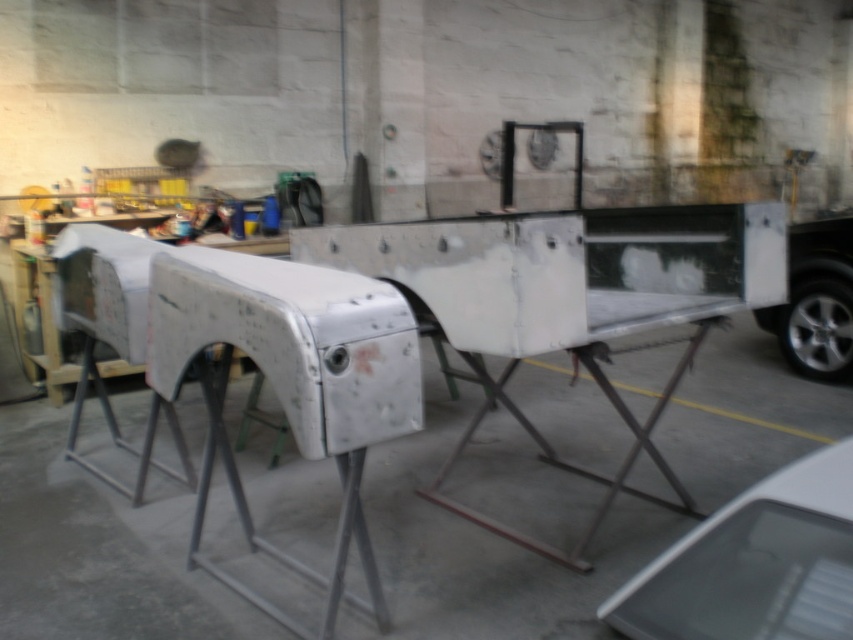
Looking at this image, you are a mechanic working in the workshop shown. You need to reach both the point at coordinates point [785,484] and point [834,308]. Which point should you approach first to reach them in the most efficient path?

You should approach point [785,484] first because it is in front of point [834,308], so reaching it first allows you to efficiently move backward to the second point without retracing steps.

You are an automotive technician assessing two car models in a workshop. The white matte car at lower right and the silver metallic car at right are both in need of restoration. Based on their sizes, which car would require more materials for a complete paint job?

The silver metallic car at right requires more materials for a complete paint job because it is larger than the white matte car at lower right.

You are a mechanic standing in the workshop and need to access the white matte car at lower right. Considering your height is 1.7 meters, can you comfortably reach the car without needing a ladder?

The white matte car at lower right is 1.17 meters away from you. Since the distance is horizontal and not vertical, your height of 1.7 meters allows you to comfortably reach the car without needing a ladder.